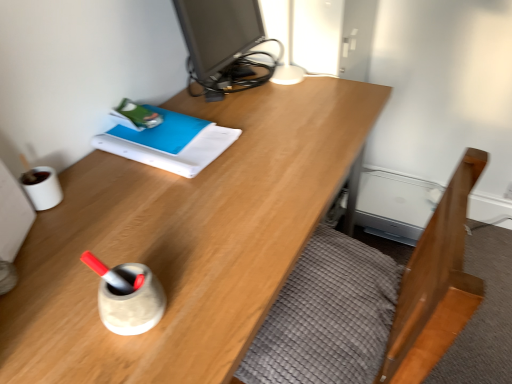
Question: Does wooden desk at center come behind wooden bed frame at lower right?

Choices:
 (A) yes
 (B) no

Answer: (B)

Question: From the image's perspective, is wooden desk at center above wooden bed frame at lower right?

Choices:
 (A) yes
 (B) no

Answer: (A)

Question: Is wooden desk at center surrounding wooden bed frame at lower right?

Choices:
 (A) yes
 (B) no

Answer: (A)

Question: Considering the relative sizes of wooden desk at center and wooden bed frame at lower right in the image provided, is wooden desk at center shorter than wooden bed frame at lower right?

Choices:
 (A) no
 (B) yes

Answer: (A)

Question: Is wooden desk at center oriented away from wooden bed frame at lower right?

Choices:
 (A) no
 (B) yes

Answer: (B)

Question: Does wooden desk at center appear on the right side of wooden bed frame at lower right?

Choices:
 (A) yes
 (B) no

Answer: (B)

Question: Does blue matte book at upper left have a greater width compared to wooden bed frame at lower right?

Choices:
 (A) yes
 (B) no

Answer: (A)

Question: Is blue matte book at upper left not within wooden bed frame at lower right?

Choices:
 (A) no
 (B) yes

Answer: (B)

Question: Are blue matte book at upper left and wooden bed frame at lower right making contact?

Choices:
 (A) no
 (B) yes

Answer: (A)

Question: Is blue matte book at upper left looking in the opposite direction of wooden bed frame at lower right?

Choices:
 (A) yes
 (B) no

Answer: (B)

Question: Is blue matte book at upper left closer to the viewer compared to wooden bed frame at lower right?

Choices:
 (A) no
 (B) yes

Answer: (A)

Question: From a real-world perspective, is blue matte book at upper left over wooden bed frame at lower right?

Choices:
 (A) yes
 (B) no

Answer: (A)

Question: Is matte black monitor at upper center located within blue matte book at upper left?

Choices:
 (A) yes
 (B) no

Answer: (B)